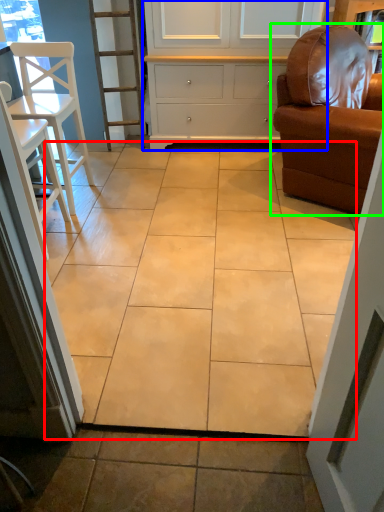
Question: Considering the real-world distances, which object is closest to ceramic tile (highlighted by a red box)? cabinetry (highlighted by a blue box) or chair (highlighted by a green box).

Choices:
 (A) cabinetry
 (B) chair

Answer: (B)